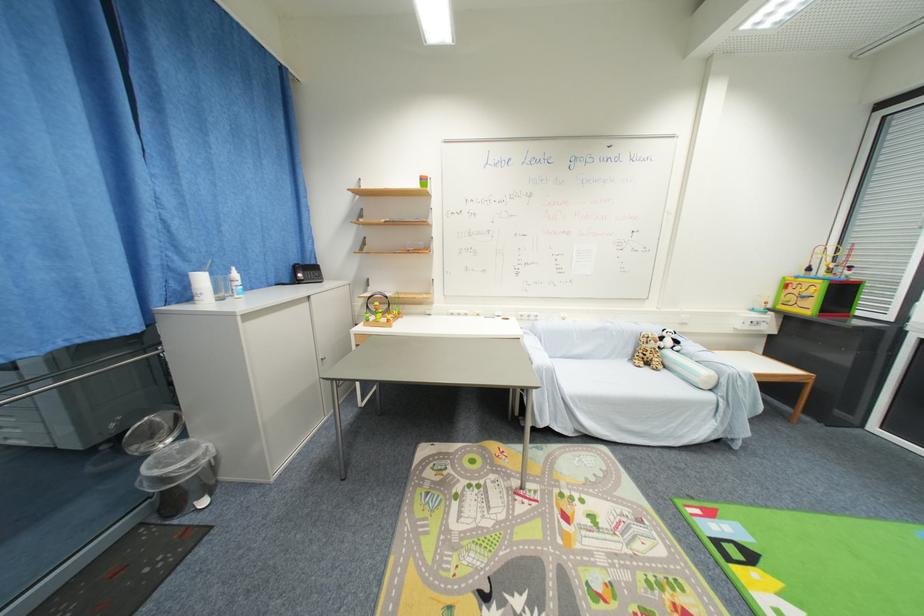
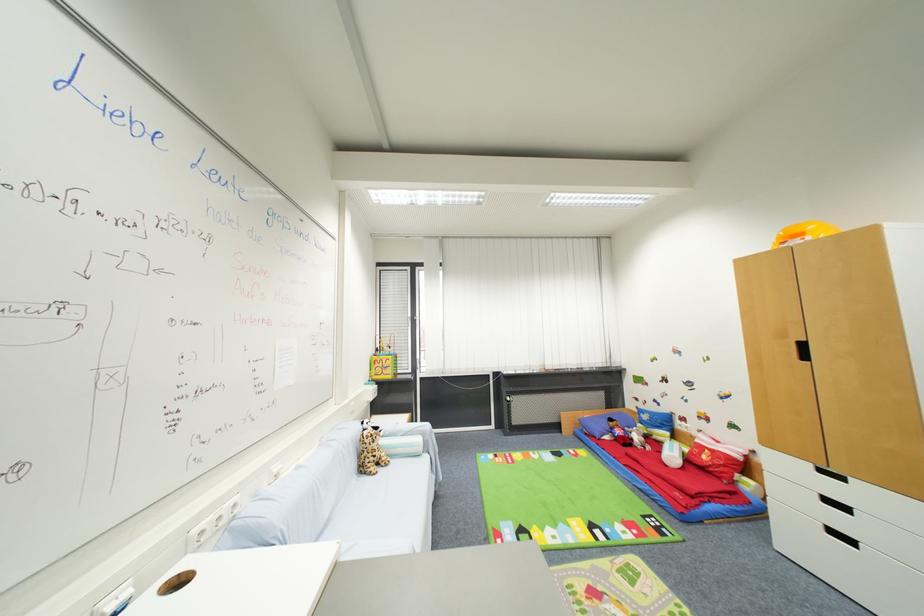
In the second image, find the point that corresponds to point 651,371 in the first image.

(385, 472)